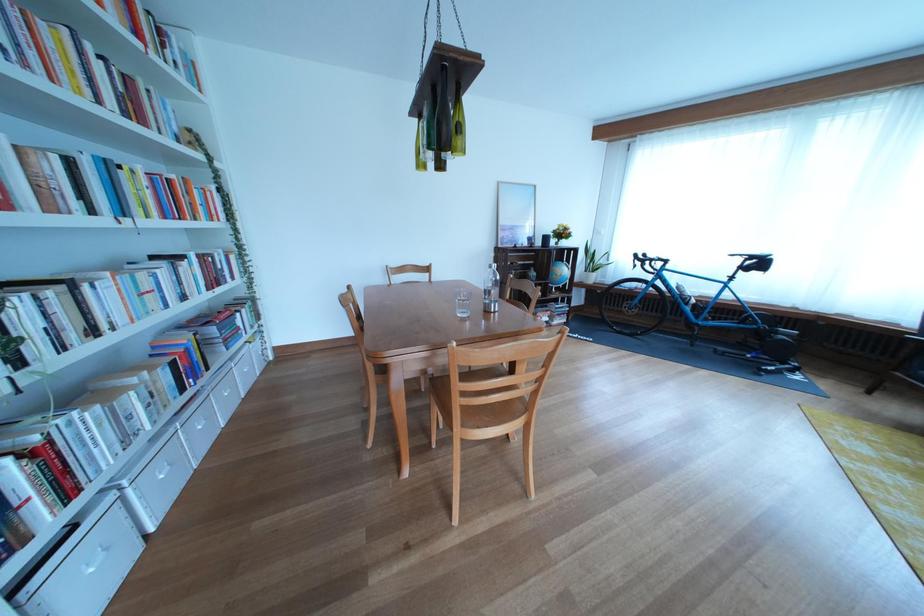
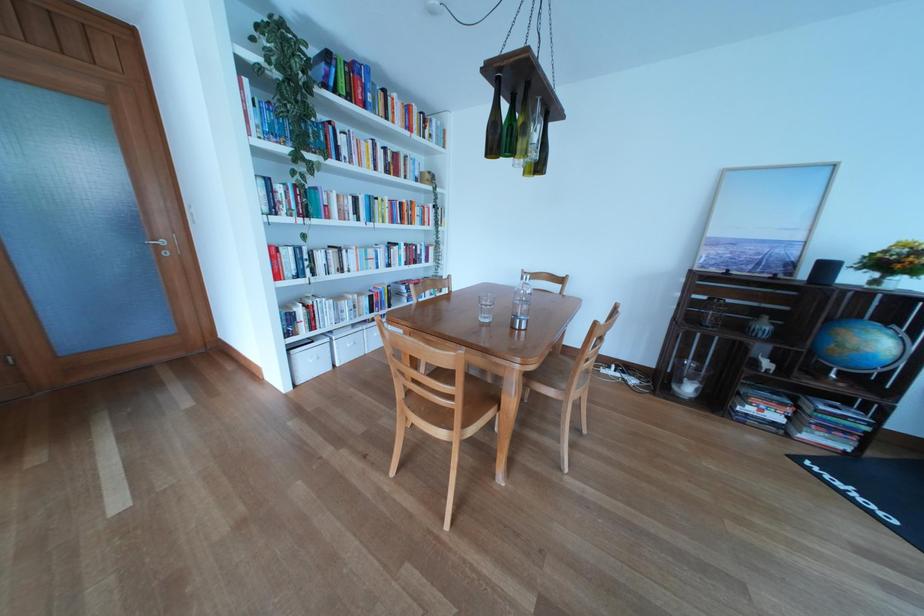
Find the pixel in the second image that matches (112,71) in the first image.

(394, 159)